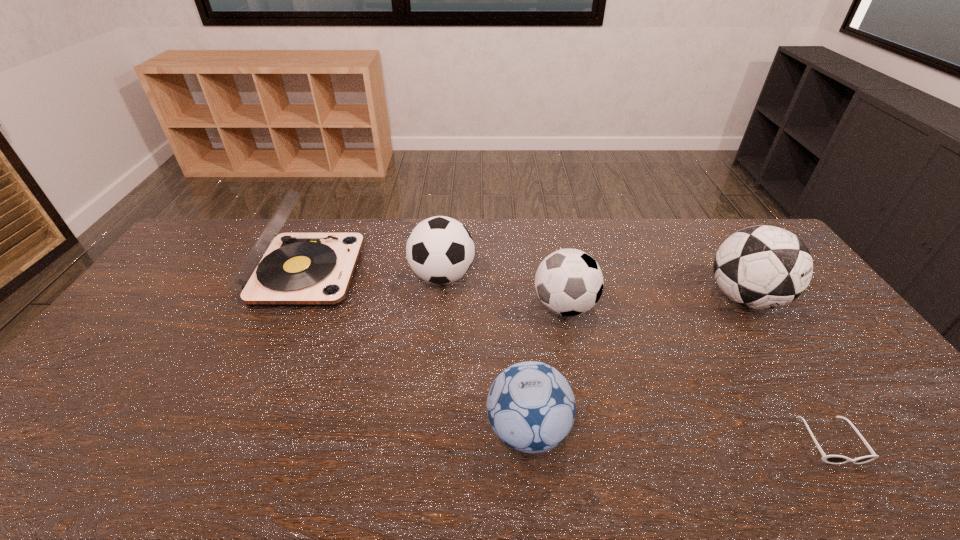
What are the coordinates of `unoccupied area between the leftmost object and the second object from left to right` in the screenshot? It's located at 373,274.

Identify the location of vacant region between the nearest soccer ball and the rightmost soccer ball. This screenshot has height=540, width=960. coord(636,364).

At what (x,y) coordinates should I click in order to perform the action: click on vacant space in between the leftmost soccer ball and the nearest soccer ball. Please return your answer as a coordinate pair (x, y). Looking at the image, I should click on (485, 353).

Find the location of a particular element. The image size is (960, 540). vacant space that's between the nearest soccer ball and the leftmost soccer ball is located at coordinates (485, 353).

The image size is (960, 540). Find the location of `vacant region between the shortest object and the rightmost soccer ball`. vacant region between the shortest object and the rightmost soccer ball is located at coordinates (788, 369).

Where is `unoccupied area between the shortest object and the leftmost object`? The height and width of the screenshot is (540, 960). unoccupied area between the shortest object and the leftmost object is located at coordinates (568, 357).

Point out which object is positioned as the second nearest to the rightmost soccer ball. Please provide its 2D coordinates. Your answer should be formatted as a tuple, i.e. [(x, y)], where the tuple contains the x and y coordinates of a point satisfying the conditions above.

[(569, 282)]

At what (x,y) coordinates should I click in order to perform the action: click on object that ranks as the fifth closest to the nearest soccer ball. Please return your answer as a coordinate pair (x, y). The width and height of the screenshot is (960, 540). Looking at the image, I should click on (762, 267).

Where is `the second closest soccer ball to the rightmost soccer ball`? the second closest soccer ball to the rightmost soccer ball is located at coordinates (531, 407).

Locate which soccer ball ranks third in proximity to the fifth object from right to left. Please provide its 2D coordinates. Your answer should be formatted as a tuple, i.e. [(x, y)], where the tuple contains the x and y coordinates of a point satisfying the conditions above.

[(762, 267)]